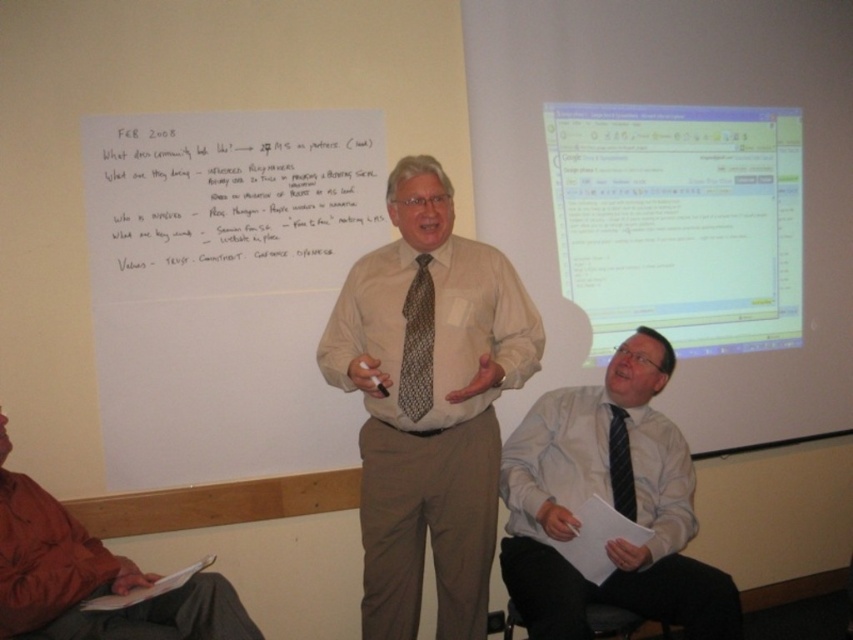
Who is lower down, white paper at upper center or white shirt at center?

white shirt at center is below.

Is point (106, 161) farther from camera compared to point (607, 458)?

No, it is not.

The image size is (853, 640). Identify the location of white paper at upper center. (236, 195).

Image resolution: width=853 pixels, height=640 pixels. What are the coordinates of `white paper at upper center` in the screenshot? It's located at (236, 195).

Is brown textured tie at center above black textured tie at center?

Yes.

Which is more to the right, brown textured tie at center or black textured tie at center?

Positioned to the right is black textured tie at center.

Between point (428, 308) and point (630, 477), which one is positioned behind?

The point (630, 477) is behind.

The image size is (853, 640). Identify the location of brown textured tie at center. (416, 342).

Between point (538, 532) and point (421, 353), which one is positioned in front?

Point (421, 353)

Between white shirt at center and brown textured tie at center, which one is positioned lower?

white shirt at center is lower down.

This screenshot has height=640, width=853. Find the location of `white shirt at center`. white shirt at center is located at coordinates (611, 502).

What are the coordinates of `white shirt at center` in the screenshot? It's located at (611, 502).